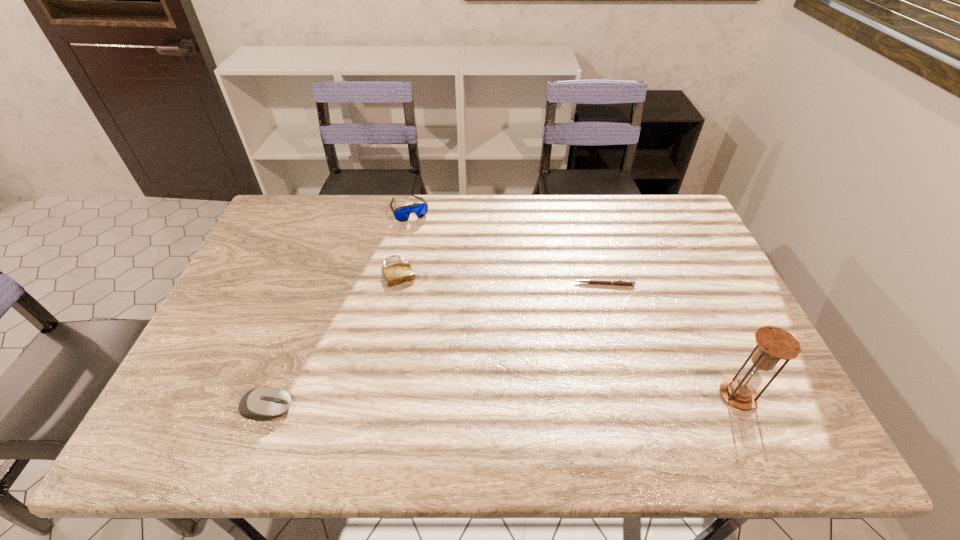
Find the location of `vacant area that lies between the computer equipment and the sunglasses`. vacant area that lies between the computer equipment and the sunglasses is located at coordinates (339, 308).

At what (x,y) coordinates should I click in order to perform the action: click on vacant area that lies between the computer equipment and the fourth object from left to right. Please return your answer as a coordinate pair (x, y). Looking at the image, I should click on (436, 346).

This screenshot has height=540, width=960. Identify the location of vacant area that lies between the shortest object and the padlock. (502, 278).

The height and width of the screenshot is (540, 960). I want to click on vacant region between the second object from right to left and the third tallest object, so click(436, 346).

Where is `vacant point located between the fourth tallest object and the tallest object`? The image size is (960, 540). vacant point located between the fourth tallest object and the tallest object is located at coordinates (568, 334).

At what (x,y) coordinates should I click in order to perform the action: click on vacant area that lies between the farthest object and the third shortest object. Please return your answer as a coordinate pair (x, y). Looking at the image, I should click on (339, 308).

Where is `free spot between the farthest object and the tallest object`? This screenshot has height=540, width=960. free spot between the farthest object and the tallest object is located at coordinates (574, 301).

Locate an element on the screen. Image resolution: width=960 pixels, height=540 pixels. vacant point located between the third tallest object and the tallest object is located at coordinates (502, 401).

Find the location of a particular element. Image resolution: width=960 pixels, height=540 pixels. free area in between the pen and the padlock is located at coordinates (502, 278).

Choose which object is the third nearest neighbor to the padlock. Please provide its 2D coordinates. Your answer should be formatted as a tuple, i.e. [(x, y)], where the tuple contains the x and y coordinates of a point satisfying the conditions above.

[(591, 281)]